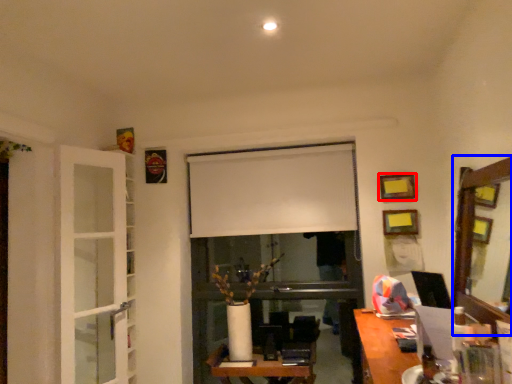
Question: Which point is further to the camera, picture frame (highlighted by a red box) or mirror (highlighted by a blue box)?

Choices:
 (A) picture frame
 (B) mirror

Answer: (A)